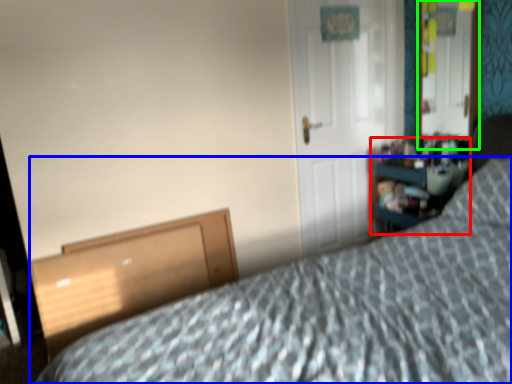
Question: Estimate the real-world distances between objects in this image. Which object is farther from dresser (highlighted by a red box), bed (highlighted by a blue box) or mirror (highlighted by a green box)?

Choices:
 (A) bed
 (B) mirror

Answer: (A)